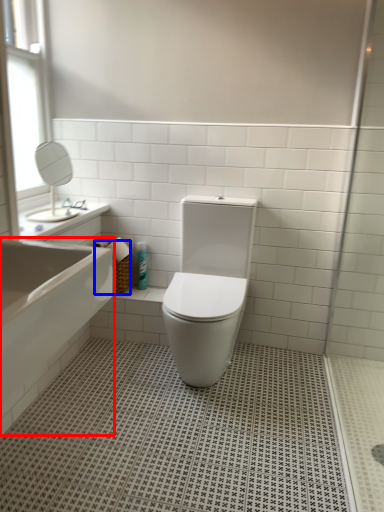
Question: Which of the following is the farthest to the observer, bath (highlighted by a red box) or basket (highlighted by a blue box)?

Choices:
 (A) bath
 (B) basket

Answer: (B)